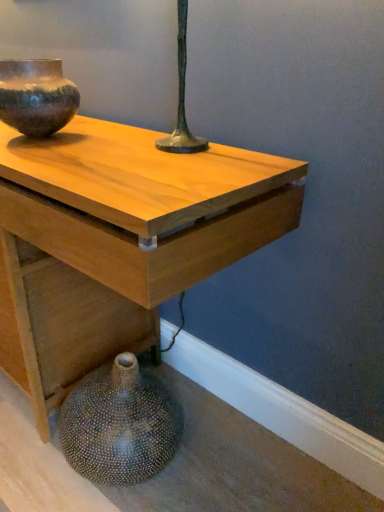
The image size is (384, 512). Find the location of `vacant space that is to the left of speckled ceramic vase at lower left, which is the 2th vase from top to bottom`. vacant space that is to the left of speckled ceramic vase at lower left, which is the 2th vase from top to bottom is located at coordinates (28, 462).